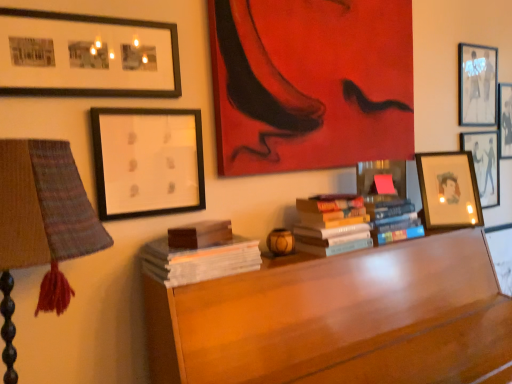
Question: From the image's perspective, does matte black picture frame at upper right, which appears as the fifth picture frame when viewed from the left, appear lower than matte black framed photos at upper left, which appears as the first picture frame when viewed from the left?

Choices:
 (A) no
 (B) yes

Answer: (A)

Question: Would you consider matte black picture frame at upper right, which appears as the fifth picture frame when viewed from the left, to be distant from matte black framed photos at upper left, which appears as the first picture frame when viewed from the left?

Choices:
 (A) yes
 (B) no

Answer: (A)

Question: Is matte black framed photos at upper left, which appears as the first picture frame when viewed from the left, completely or partially inside matte black picture frame at upper right, the third picture frame from the right?

Choices:
 (A) no
 (B) yes

Answer: (A)

Question: Is matte black picture frame at upper right, the third picture frame from the right, bigger than matte black framed photos at upper left, which appears as the first picture frame when viewed from the left?

Choices:
 (A) yes
 (B) no

Answer: (B)

Question: Does matte black picture frame at upper right, the third picture frame from the right, have a lesser height compared to matte black framed photos at upper left, marked as the seventh picture frame in a right-to-left arrangement?

Choices:
 (A) no
 (B) yes

Answer: (A)

Question: From the image's perspective, relative to matte paper picture frame at right, which is counted as the sixth picture frame, starting from the left, is wooden desk at center above or below?

Choices:
 (A) above
 (B) below

Answer: (B)

Question: Looking at the image, does wooden desk at center seem bigger or smaller compared to matte paper picture frame at right, arranged as the second picture frame when viewed from the right?

Choices:
 (A) big
 (B) small

Answer: (A)

Question: Is wooden desk at center in front of or behind matte paper picture frame at right, arranged as the second picture frame when viewed from the right, in the image?

Choices:
 (A) behind
 (B) front

Answer: (B)

Question: Is point (368, 342) closer or farther from the camera than point (495, 152)?

Choices:
 (A) closer
 (B) farther

Answer: (A)

Question: Considering the relative positions of matte wooden picture frame at right, the 4th picture frame when ordered from left to right, and matte red painting at upper center, acting as the third picture frame starting from the left, in the image provided, is matte wooden picture frame at right, the 4th picture frame when ordered from left to right, to the left or to the right of matte red painting at upper center, acting as the third picture frame starting from the left,?

Choices:
 (A) right
 (B) left

Answer: (A)

Question: Is matte wooden picture frame at right, the 4th picture frame when ordered from left to right, bigger or smaller than matte red painting at upper center, acting as the third picture frame starting from the left?

Choices:
 (A) small
 (B) big

Answer: (A)

Question: Which is correct: matte wooden picture frame at right, which is the 4th picture frame from right to left, is inside matte red painting at upper center, which is the 5th picture frame from right to left, or outside of it?

Choices:
 (A) outside
 (B) inside

Answer: (A)

Question: Considering the positions of matte wooden picture frame at right, the 4th picture frame when ordered from left to right, and matte red painting at upper center, which is the 5th picture frame from right to left, in the image, is matte wooden picture frame at right, the 4th picture frame when ordered from left to right, wider or thinner than matte red painting at upper center, which is the 5th picture frame from right to left,?

Choices:
 (A) thin
 (B) wide

Answer: (B)

Question: From a real-world perspective, relative to matte black picture frame at upper right, which appears as the fifth picture frame when viewed from the left, is wooden desk at center vertically above or below?

Choices:
 (A) below
 (B) above

Answer: (A)

Question: Looking at their shapes, would you say wooden desk at center is wider or thinner than matte black picture frame at upper right, the third picture frame from the right?

Choices:
 (A) wide
 (B) thin

Answer: (A)